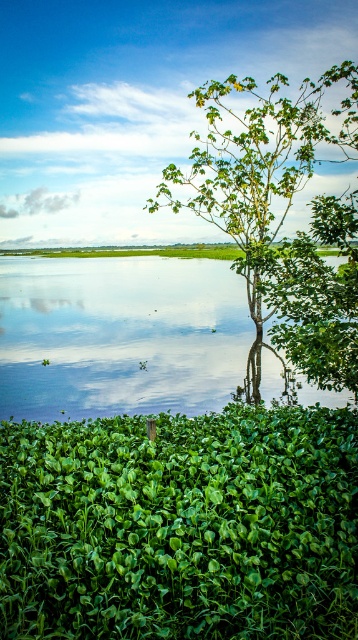
You are a gardener who needs to water both the green leafy plant at lower center and the green leafy tree at center. Since you have limited water, which one requires more water based on their sizes?

The green leafy tree at center requires more water because it is larger in size than the green leafy plant at lower center.

You are a photographer aiming to capture the green leafy tree at center and the transparent water at center in your shot. Based on their positions, which object is positioned to the left of the other?

The transparent water at center is to the left of the green leafy tree at center.

You are a drone operator trying to capture aerial shots of the landscape. You have two points marked on your map for reference. Point A is at coordinates point (73,307) and Point B is at point (289,99). If you want to fly the drone from the foreground towards the horizon, which point should you prioritize to ensure the drone stays within the visible area of the scene?

Point B at point (289,99) should be prioritized because Point A is behind Point B, so flying towards the horizon would mean Point B is closer to the foreground and within the visible area.